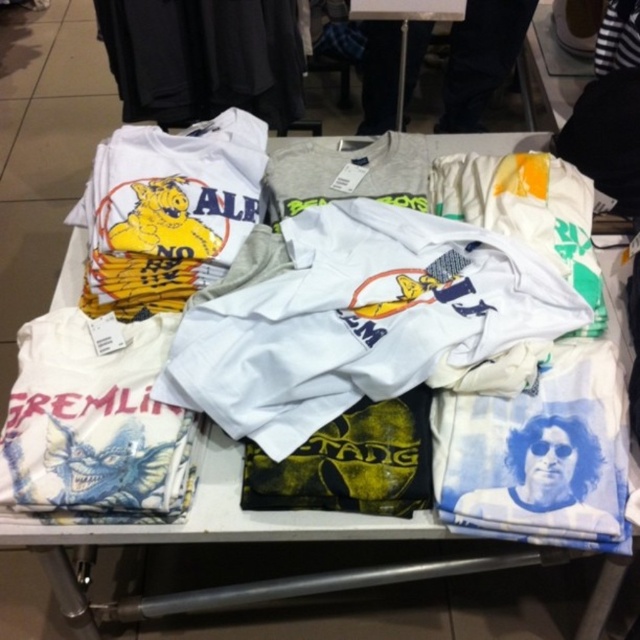
Question: Which of the following is the closest to the observer?

Choices:
 (A) black matte t-shirt at upper left
 (B) white cotton t-shirt at upper center

Answer: (A)

Question: Can you confirm if white cotton t-shirt at center is positioned below yellow matte t-shirt at upper left?

Choices:
 (A) no
 (B) yes

Answer: (B)

Question: Is white cotton t-shirt at center smaller than white cotton t-shirt at upper center?

Choices:
 (A) yes
 (B) no

Answer: (A)

Question: Which of the following is the closest to the observer?

Choices:
 (A) white cotton t-shirt at upper center
 (B) yellow matte t-shirt at upper left

Answer: (B)

Question: Which of the following is the closest to the observer?

Choices:
 (A) yellow matte t-shirt at upper left
 (B) white cotton t-shirt at center

Answer: (B)

Question: Can you confirm if white cotton t-shirt at center is wider than white cotton t-shirt at upper center?

Choices:
 (A) yes
 (B) no

Answer: (A)